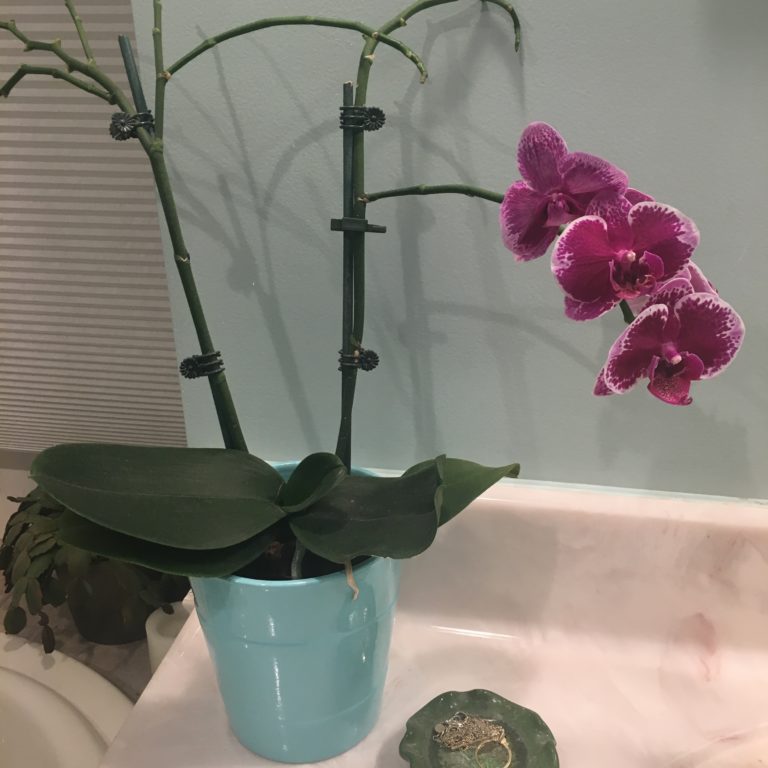
Locate an element on the screen. This screenshot has height=768, width=768. blue pot is located at coordinates (277, 664).